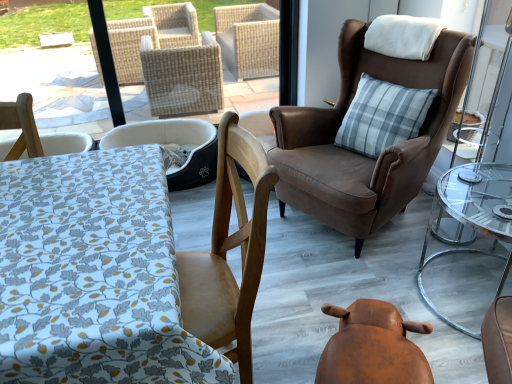
Question: In the image, is gray plaid pillow at upper right positioned in front of or behind brown suede armchair at upper right, which is counted as the 1th chair, starting from the right?

Choices:
 (A) front
 (B) behind

Answer: (B)

Question: From the image's perspective, is gray plaid pillow at upper right positioned above or below brown suede armchair at upper right, the 3th chair viewed from the left?

Choices:
 (A) below
 (B) above

Answer: (B)

Question: Considering the real-world distances, which object is closest to the white fabric pet bed at center, acting as the first chair starting from the left?

Choices:
 (A) brown leather swivel chair at lower center
 (B) brown suede armchair at upper right, the 3th chair viewed from the left
 (C) wooden chair at left, which is the 2th chair from left to right
 (D) clear glass table at right
 (E) gray plaid pillow at upper right

Answer: (B)

Question: Which object is the farthest from the wooden chair at left, which is the 2th chair from left to right?

Choices:
 (A) clear glass table at right
 (B) gray plaid pillow at upper right
 (C) brown suede armchair at upper right, the 3th chair viewed from the left
 (D) white fabric pet bed at center, the third chair viewed from the right
 (E) brown leather swivel chair at lower center

Answer: (B)